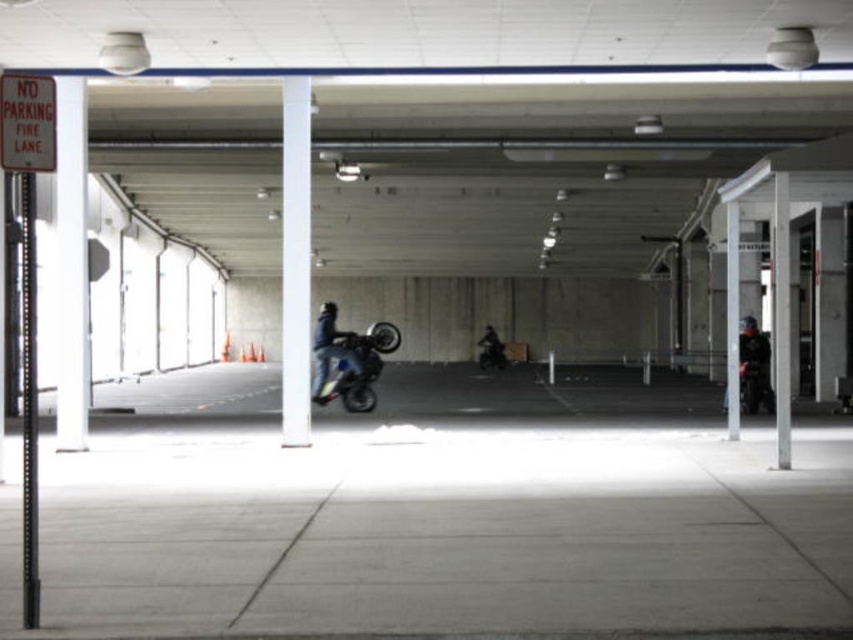
You are a parking attendant checking vehicle dimensions. The motorcycle must be wider than the pole to park legally. Can the shiny blue motorcycle at center park legally next to the black glossy pole at left?

The black glossy pole at left is thinner than shiny blue motorcycle at center, so the motorcycle is wider than the pole. Therefore, the shiny blue motorcycle at center can park legally next to the black glossy pole at left.

You are a parking attendant who needs to ensure vehicles don not block the fire lane. You see the dark blue leather jacket at center and the shiny chrome motorcycle at center. Which object is narrower and therefore less likely to block the fire lane if parked there?

The dark blue leather jacket at center is thinner than the shiny chrome motorcycle at center, so the dark blue leather jacket at center is narrower and less likely to block the fire lane.